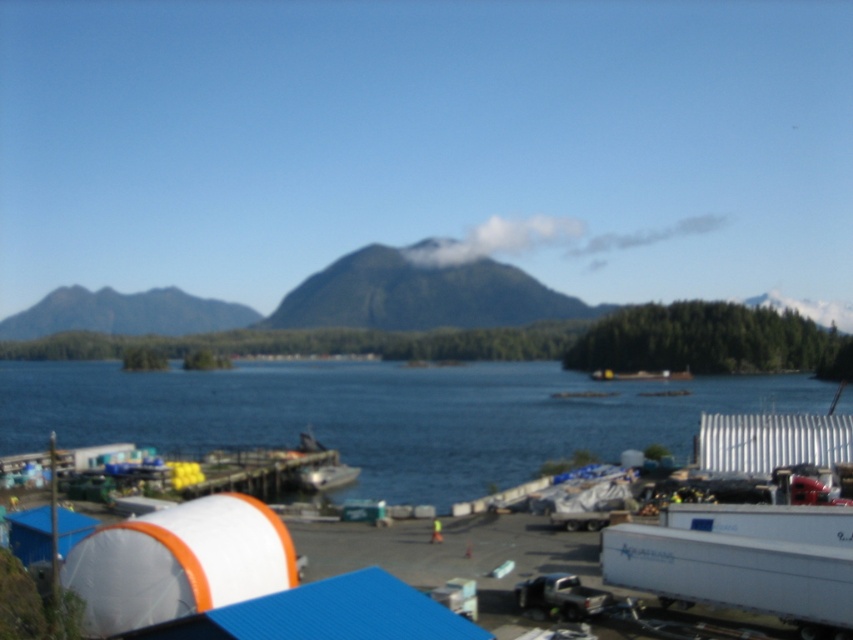
You are a photographer planning to capture the entire coastal scene. You notice the blue water at center and the green textured mountain at upper left. Which of these two objects will appear taller in your photo?

The green textured mountain at upper left appears taller than the blue water at center in the photo because the blue water at center is not as tall as the green textured mountain at upper left.